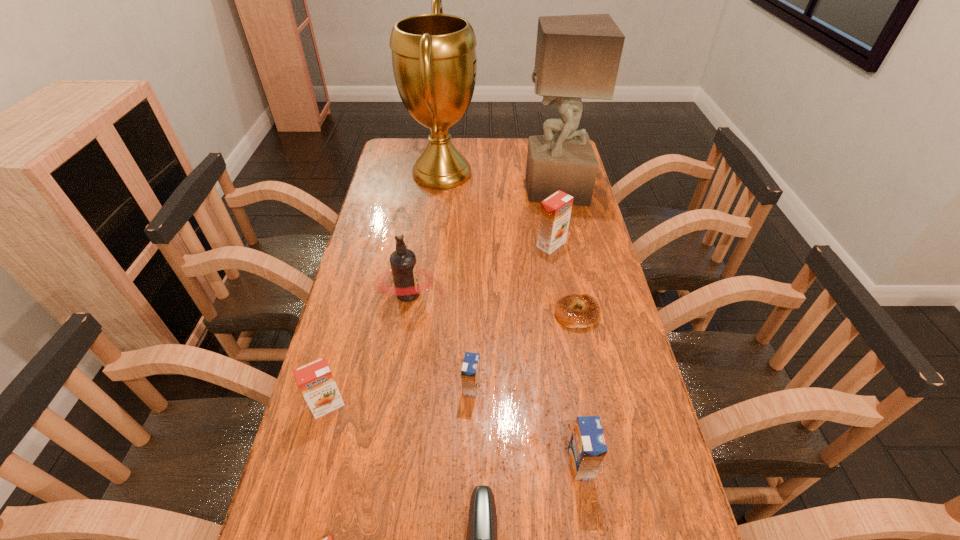
Identify the location of vacant area that lies between the left blue orange_juice and the gold trophy cup. The width and height of the screenshot is (960, 540). (457, 280).

Identify the location of the fourth closest object to the electric shaver. (315, 380).

Locate which object is the eighth closest to the shortest object. Please provide its 2D coordinates. Your answer should be formatted as a tuple, i.e. [(x, y)], where the tuple contains the x and y coordinates of a point satisfying the conditions above.

[(315, 380)]

The height and width of the screenshot is (540, 960). I want to click on the fourth closest orange juice to the second nearest orange juice, so click(x=555, y=212).

The image size is (960, 540). What are the coordinates of `orange juice that is the closest to the third tallest object` in the screenshot? It's located at (470, 373).

At what (x,y) coordinates should I click in order to perform the action: click on orange orange juice identified as the second closest to the trophy cup. Please return your answer as a coordinate pair (x, y). Image resolution: width=960 pixels, height=540 pixels. Looking at the image, I should click on (315, 380).

Find the location of a particular element. The height and width of the screenshot is (540, 960). orange orange juice that stands as the closest to the smallest orange orange juice is located at coordinates (315, 380).

Find the location of `free spot that satisfies the following two spatial constraints: 1. on the surface of the gold trophy cup with symbols; 2. on the back side of the left blue orange_juice`. free spot that satisfies the following two spatial constraints: 1. on the surface of the gold trophy cup with symbols; 2. on the back side of the left blue orange_juice is located at coordinates (418, 387).

I want to click on vacant space that satisfies the following two spatial constraints: 1. on the back side of the shortest object; 2. on the label of the third tallest object, so click(x=573, y=294).

The image size is (960, 540). What are the coordinates of `free space that satisfies the following two spatial constraints: 1. on the front-facing side of the sculpture; 2. on the front side of the bigger blue orange_juice` in the screenshot? It's located at (612, 464).